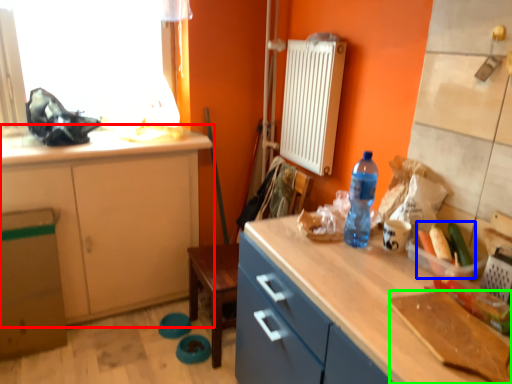
Question: Based on their relative distances, which object is nearer to cabinetry (highlighted by a red box)? Choose from food (highlighted by a blue box) and cutting board (highlighted by a green box).

Choices:
 (A) food
 (B) cutting board

Answer: (A)